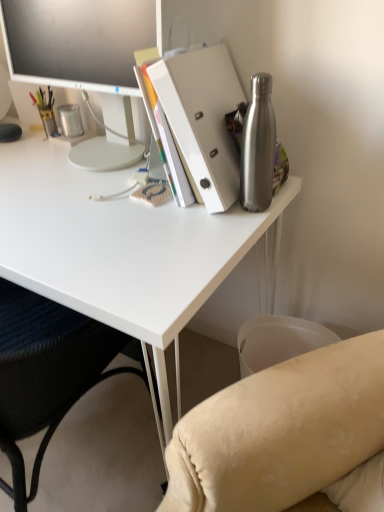
Locate an element on the screen. Image resolution: width=384 pixels, height=512 pixels. free space in front of brushed metal water bottle at right is located at coordinates (219, 245).